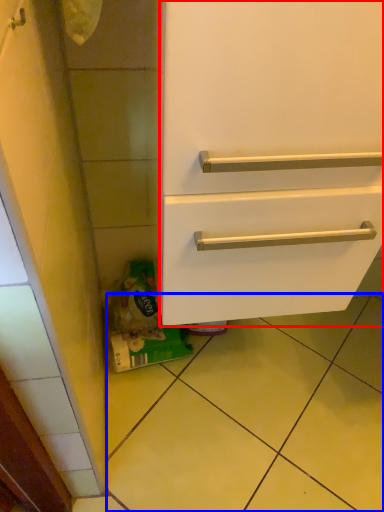
Question: Which of the following is the farthest to the observer, drawer (highlighted by a red box) or tile (highlighted by a blue box)?

Choices:
 (A) drawer
 (B) tile

Answer: (B)